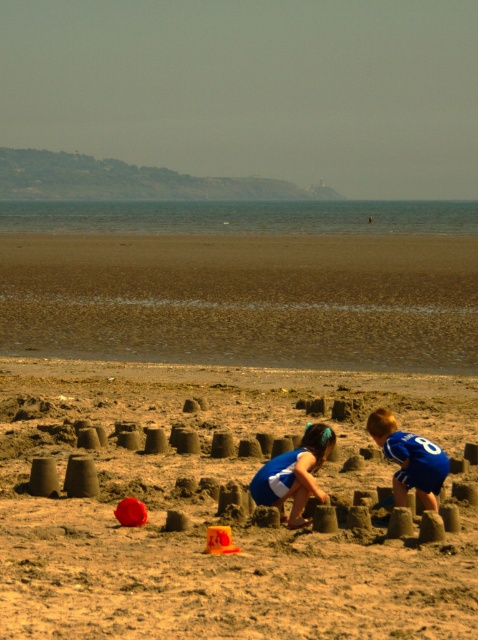
Which is behind, point (324, 451) or point (373, 440)?

The point (373, 440) is more distant.

Locate an element on the screen. blue fabric dress at center is located at coordinates (294, 474).

Does brown sandy beach at center have a smaller size compared to blue jersey at lower right?

Actually, brown sandy beach at center might be larger than blue jersey at lower right.

The image size is (478, 640). Describe the element at coordinates (221, 509) in the screenshot. I see `brown sandy beach at center` at that location.

Is point (237, 522) farther from viewer compared to point (398, 449)?

Yes, it is.

Locate an element on the screen. The image size is (478, 640). brown sandy beach at center is located at coordinates (221, 509).

Measure the distance between point (147, 556) and camera.

The distance of point (147, 556) from camera is 30.85 feet.

Does brown sandy beach at center have a smaller size compared to blue fabric dress at center?

No.

Does point (463, 611) lie in front of point (284, 518)?

Yes, it is.

Identify the location of brown sandy beach at center. The height and width of the screenshot is (640, 478). (221, 509).